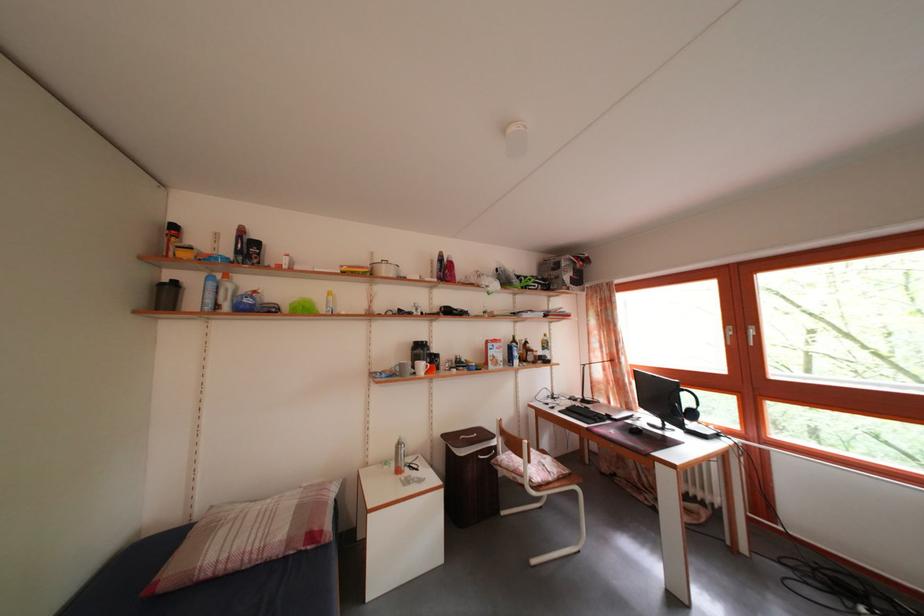
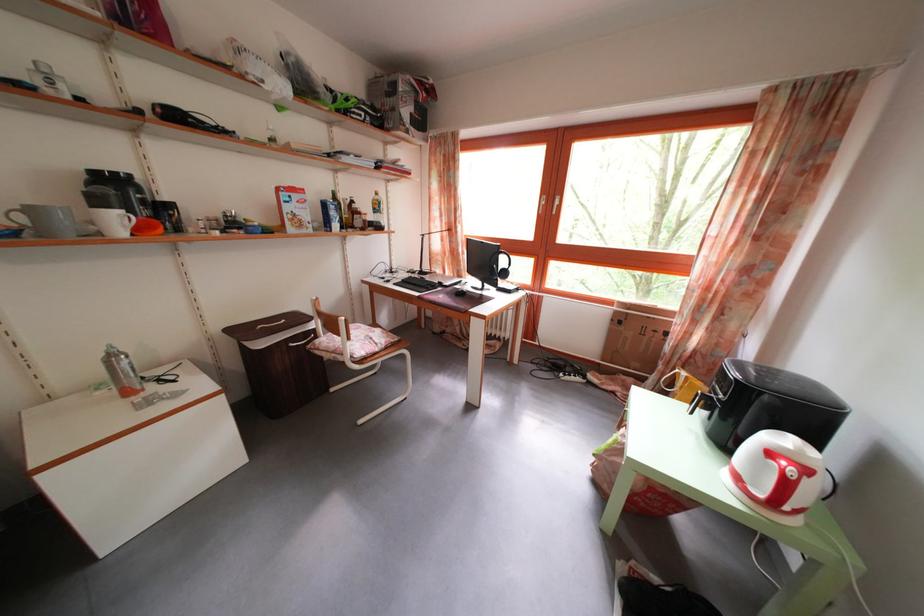
Find the pixel in the second image that matches the point at 667,400 in the first image.

(492, 265)